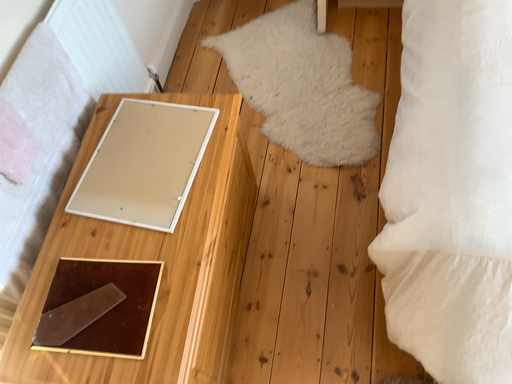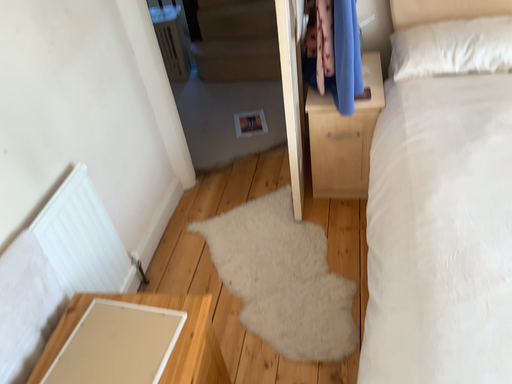
Question: Which way did the camera rotate in the video?

Choices:
 (A) rotated upward
 (B) rotated downward

Answer: (A)